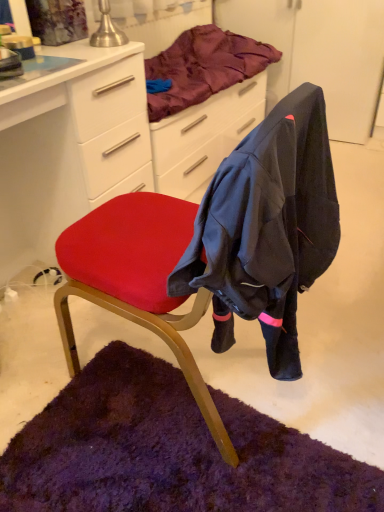
Describe the element at coordinates (217, 247) in the screenshot. I see `velvet red chair at center` at that location.

Measure the distance between point (144, 131) and camera.

The depth of point (144, 131) is 1.55 meters.

Image resolution: width=384 pixels, height=512 pixels. What do you see at coordinates (70, 147) in the screenshot? I see `matte white desk at center` at bounding box center [70, 147].

Describe the element at coordinates (203, 67) in the screenshot. This screenshot has width=384, height=512. I see `satin purple blanket at upper center` at that location.

This screenshot has width=384, height=512. Identify the location of satin purple blanket at upper center. (203, 67).

Locate an element on the screen. velvet red chair at center is located at coordinates (217, 247).

What are the coordinates of `desk below the satin purple blanket at upper center (from the image's perspective)` in the screenshot? It's located at tap(70, 147).

Which of these two, matte white desk at center or satin purple blanket at upper center, is thinner?

satin purple blanket at upper center is thinner.

Based on the photo, is matte white desk at center to the left or to the right of satin purple blanket at upper center in the image?

Based on their positions, matte white desk at center is located to the left of satin purple blanket at upper center.

Which object is further away from the camera, matte white desk at center or satin purple blanket at upper center?

satin purple blanket at upper center is further away from the camera.

Considering the relative sizes of velvet red chair at center and matte white desk at center in the image provided, is velvet red chair at center wider than matte white desk at center?

Yes, velvet red chair at center is wider than matte white desk at center.

What's the angular difference between velvet red chair at center and matte white desk at center's facing directions?

178 degrees separate the facing orientations of velvet red chair at center and matte white desk at center.

Which of these two, velvet red chair at center or matte white desk at center, stands taller?

Standing taller between the two is velvet red chair at center.

In the scene shown: From a real-world perspective, is velvet red chair at center beneath matte white desk at center?

No, from a real-world perspective, velvet red chair at center is not under matte white desk at center.

From the image's perspective, is matte white desk at center above or below velvet red chair at center?

Based on their image positions, matte white desk at center is located above velvet red chair at center.

Is matte white desk at center taller than velvet red chair at center?

In fact, matte white desk at center may be shorter than velvet red chair at center.

Is matte white desk at center located outside velvet red chair at center?

Indeed, matte white desk at center is completely outside velvet red chair at center.

Does satin purple blanket at upper center come in front of matte white desk at center?

No, it is behind matte white desk at center.

Looking at this image, is satin purple blanket at upper center thinner than matte white desk at center?

Yes, satin purple blanket at upper center is thinner than matte white desk at center.

In the scene shown: Could you tell me if satin purple blanket at upper center is turned towards matte white desk at center?

No, satin purple blanket at upper center is not facing towards matte white desk at center.

From a real-world perspective, is satin purple blanket at upper center physically below velvet red chair at center?

Incorrect, from a real-world perspective, satin purple blanket at upper center is higher than velvet red chair at center.

You are a GUI agent. You are given a task and a screenshot of the screen. Output one action in this format:
    pyautogui.click(x=<x>, y=<y>)
    Task: Click on the blanket located behind the velvet red chair at center
    This screenshot has height=512, width=384.
    Given the screenshot: What is the action you would take?
    pyautogui.click(x=203, y=67)

Is satin purple blanket at upper center oriented towards velvet red chair at center?

No, satin purple blanket at upper center does not turn towards velvet red chair at center.

Is satin purple blanket at upper center in front of or behind velvet red chair at center in the image?

satin purple blanket at upper center is behind velvet red chair at center.

Which object is thinner, velvet red chair at center or satin purple blanket at upper center?

Thinner between the two is satin purple blanket at upper center.

From a real-world perspective, who is located higher, velvet red chair at center or satin purple blanket at upper center?

satin purple blanket at upper center is physically above.

Is point (143, 265) more distant than point (260, 61)?

No, it is in front of (260, 61).

From their relative heights in the image, would you say velvet red chair at center is taller or shorter than satin purple blanket at upper center?

Clearly, velvet red chair at center is taller compared to satin purple blanket at upper center.

Image resolution: width=384 pixels, height=512 pixels. Find the location of `blanket that appears behind the matte white desk at center`. blanket that appears behind the matte white desk at center is located at coordinates pyautogui.click(x=203, y=67).

The image size is (384, 512). What are the coordinates of `desk to the left of velvet red chair at center` in the screenshot? It's located at (70, 147).

Looking at the image, which one is located closer to matte white desk at center, satin purple blanket at upper center or velvet red chair at center?

satin purple blanket at upper center.

Estimate the real-world distances between objects in this image. Which object is closer to velvet red chair at center, matte white desk at center or satin purple blanket at upper center?

Among the two, matte white desk at center is located nearer to velvet red chair at center.

Estimate the real-world distances between objects in this image. Which object is further from velvet red chair at center, satin purple blanket at upper center or matte white desk at center?

Based on the image, satin purple blanket at upper center appears to be further to velvet red chair at center.

When comparing their distances from matte white desk at center, does velvet red chair at center or satin purple blanket at upper center seem closer?

Based on the image, satin purple blanket at upper center appears to be nearer to matte white desk at center.

Estimate the real-world distances between objects in this image. Which object is further from satin purple blanket at upper center, matte white desk at center or velvet red chair at center?

velvet red chair at center is positioned further to the anchor satin purple blanket at upper center.

In the scene shown: From the image, which object appears to be nearer to satin purple blanket at upper center, velvet red chair at center or matte white desk at center?

matte white desk at center is closer to satin purple blanket at upper center.

You are a GUI agent. You are given a task and a screenshot of the screen. Output one action in this format:
    pyautogui.click(x=<x>, y=<y>)
    Task: Click on the desk between satin purple blanket at upper center and velvet red chair at center vertically
    The image size is (384, 512).
    Given the screenshot: What is the action you would take?
    pyautogui.click(x=70, y=147)